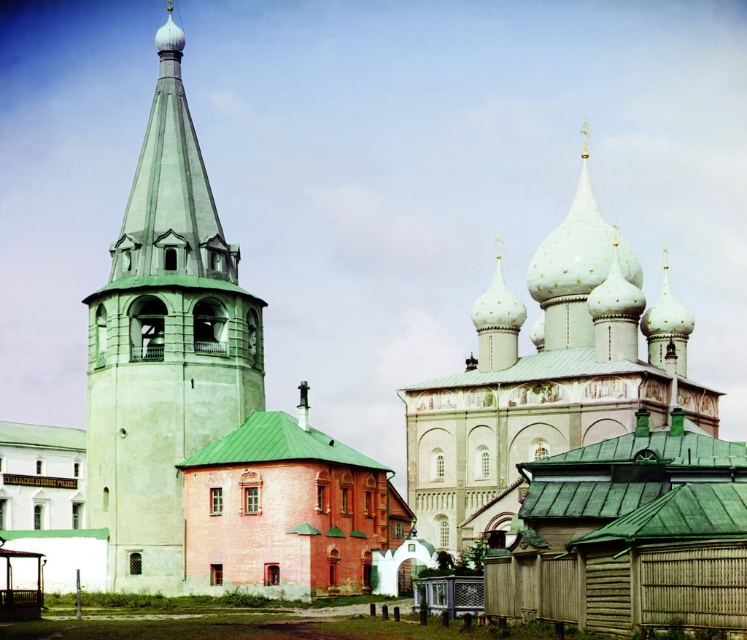
You are standing at the center of the image. Which direction should you face to look at the green tiled bell tower at left?

The green tiled bell tower at left is located at point (164, 344), which is to the left side of the image. Therefore, you should turn your head or body to the left to face it.

You are standing at the point marked by point (164,344), which is located at the green tiled bell tower at left. What is the nearest building to you?

The nearest building to you is the green tiled bell tower at left, as you are standing at its marked point.

You are an architect analyzing the height of structures in the image. Given that the green tiled bell tower at left and the white painted stone tower at upper center are both visible, which one do you think is taller?

The green tiled bell tower at left is much taller than the white painted stone tower at upper center, so the green tiled bell tower at left is taller.